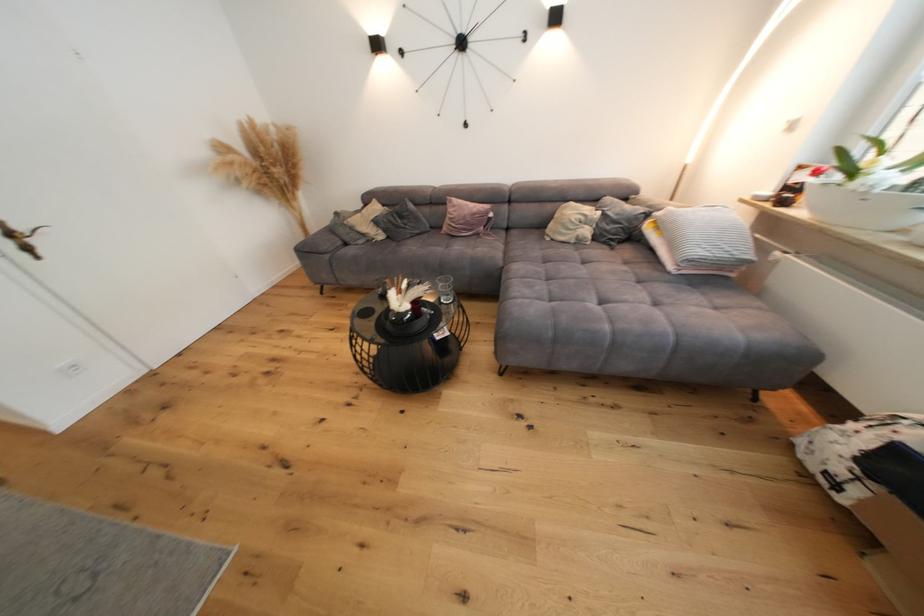
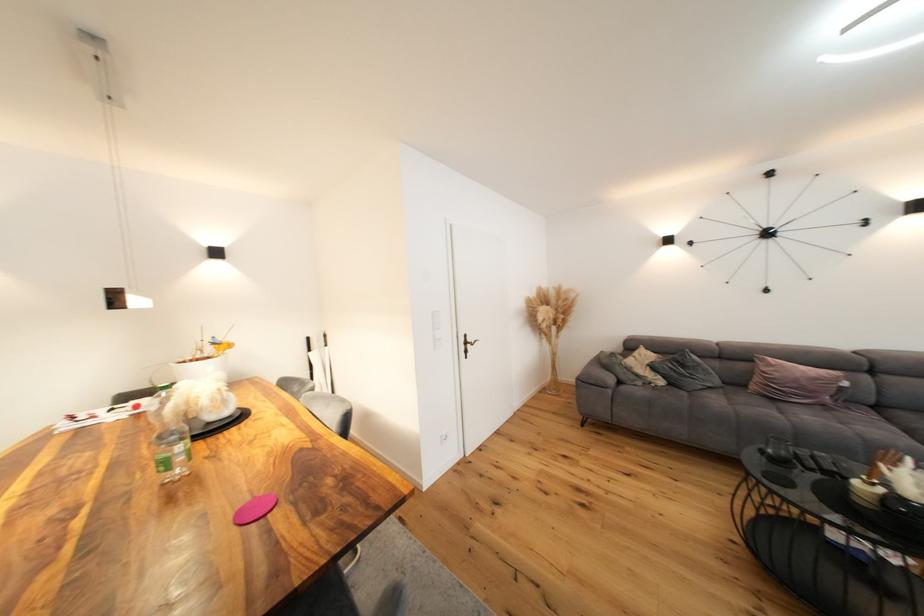
In the second image, find the point that corresponds to [481,216] in the first image.

(822, 381)